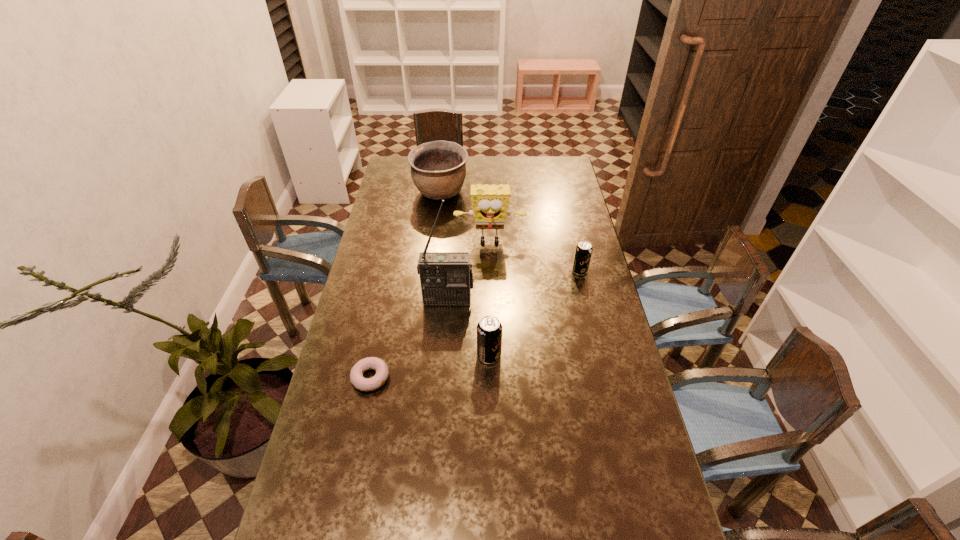
What are the coordinates of `the shortest object` in the screenshot? It's located at (358, 381).

Image resolution: width=960 pixels, height=540 pixels. What are the coordinates of `vacant space situated on the front of the left soda can` in the screenshot? It's located at (492, 475).

I want to click on free space located on the left of the right soda can, so click(486, 271).

Locate an element on the screen. free space located 0.290m on the display of the radio receiver is located at coordinates (443, 375).

Where is `vacant area situated on the back of the pottery`? vacant area situated on the back of the pottery is located at coordinates 444,160.

The image size is (960, 540). Identify the location of free space located 0.070m on the front-facing side of the second farthest object. (490, 263).

I want to click on vacant point located on the back of the shortest object, so click(x=386, y=304).

At what (x,y) coordinates should I click in order to perform the action: click on object located at the far edge. Please return your answer as a coordinate pair (x, y). The height and width of the screenshot is (540, 960). Looking at the image, I should click on (438, 169).

You are a GUI agent. You are given a task and a screenshot of the screen. Output one action in this format:
    pyautogui.click(x=<x>, y=<y>)
    Task: Click on the pottery located at the left edge
    The image size is (960, 540).
    Given the screenshot: What is the action you would take?
    pyautogui.click(x=438, y=169)

Identify the location of doughnut that is at the left edge. (358, 381).